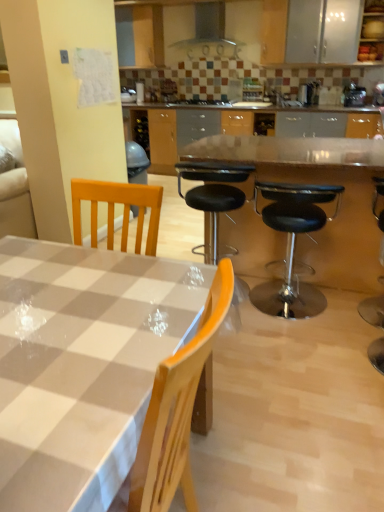
Question: From the image's perspective, is black leather bar stool at right below wooden cabinet at upper right?

Choices:
 (A) yes
 (B) no

Answer: (A)

Question: Is black leather bar stool at right further to the viewer compared to wooden cabinet at upper right?

Choices:
 (A) no
 (B) yes

Answer: (A)

Question: Is black leather bar stool at right turned away from wooden cabinet at upper right?

Choices:
 (A) no
 (B) yes

Answer: (A)

Question: From a real-world perspective, is black leather bar stool at right positioned over wooden cabinet at upper right based on gravity?

Choices:
 (A) yes
 (B) no

Answer: (B)

Question: Is black leather bar stool at right aimed at wooden cabinet at upper right?

Choices:
 (A) yes
 (B) no

Answer: (A)

Question: Is black leather bar stool at right spatially inside black glass gas stove at center, or outside of it?

Choices:
 (A) inside
 (B) outside

Answer: (B)

Question: From their relative heights in the image, would you say black leather bar stool at right is taller or shorter than black glass gas stove at center?

Choices:
 (A) tall
 (B) short

Answer: (A)

Question: From the image's perspective, relative to black glass gas stove at center, is black leather bar stool at right above or below?

Choices:
 (A) below
 (B) above

Answer: (A)

Question: From a real-world perspective, relative to black glass gas stove at center, is black leather bar stool at right vertically above or below?

Choices:
 (A) below
 (B) above

Answer: (A)

Question: From a real-world perspective, relative to black leather stool at center, marked as the first chair in a left-to-right arrangement, is black leather stool at center, the second chair in the left-to-right sequence, vertically above or below?

Choices:
 (A) above
 (B) below

Answer: (B)

Question: In terms of height, does black leather stool at center, marked as the 1th chair in a right-to-left arrangement, look taller or shorter compared to black leather stool at center, the 2th chair positioned from the right?

Choices:
 (A) tall
 (B) short

Answer: (B)

Question: Looking at the image, does black leather stool at center, the second chair in the left-to-right sequence, seem bigger or smaller compared to black leather stool at center, marked as the first chair in a left-to-right arrangement?

Choices:
 (A) big
 (B) small

Answer: (B)

Question: In the image, is black leather stool at center, the second chair in the left-to-right sequence, on the left side or the right side of black leather stool at center, the 2th chair positioned from the right?

Choices:
 (A) right
 (B) left

Answer: (A)

Question: From their relative heights in the image, would you say transparent glass table at center is taller or shorter than black leather stool at center, the second chair in the left-to-right sequence?

Choices:
 (A) tall
 (B) short

Answer: (A)

Question: Is transparent glass table at center inside the boundaries of black leather stool at center, the second chair in the left-to-right sequence, or outside?

Choices:
 (A) inside
 (B) outside

Answer: (B)